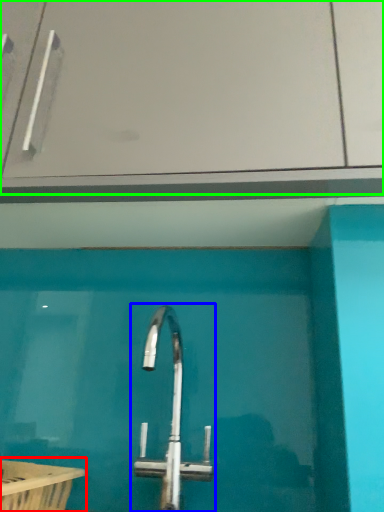
Question: Which is farther away from bath (highlighted by a red box)? tap (highlighted by a blue box) or glass door (highlighted by a green box)?

Choices:
 (A) tap
 (B) glass door

Answer: (B)